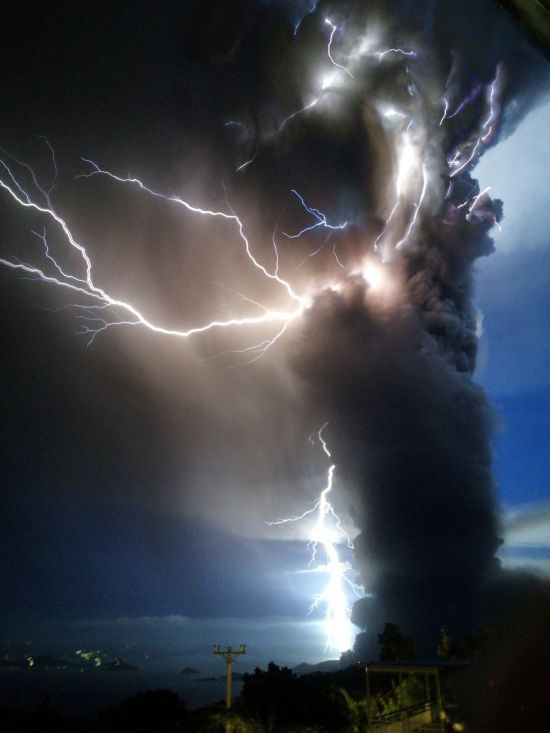
Identify the location of light. (390, 710).